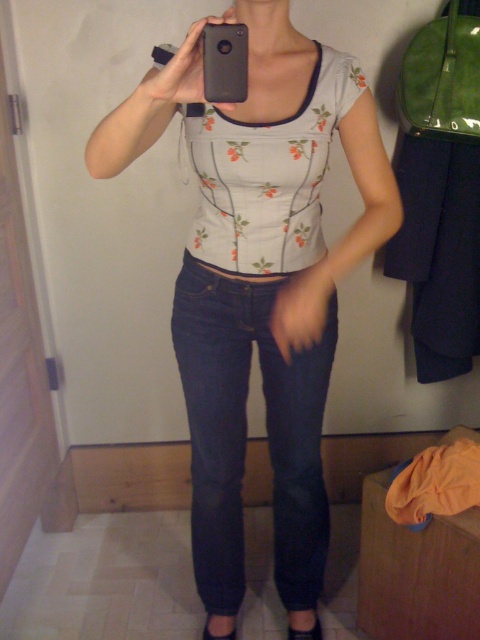
You are standing in a dressing room and want to take a selfie using the mirror. The mirror is located at point (208, 310), which is 4.35 feet away from you. If your arm length is 2.5 feet, can you reach the mirror to adjust it?

The distance of point (208, 310) from viewer is 4.35 feet, so no, you cannot reach the mirror to adjust it since it is farther than your arm length of 2.5 feet.